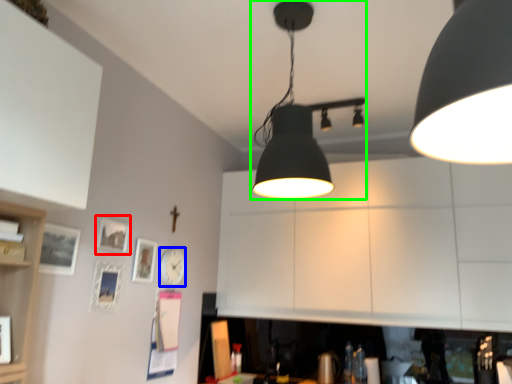
Question: Based on their relative distances, which object is farther from picture frame (highlighted by a red box)? Choose from clock (highlighted by a blue box) and lamp (highlighted by a green box).

Choices:
 (A) clock
 (B) lamp

Answer: (B)